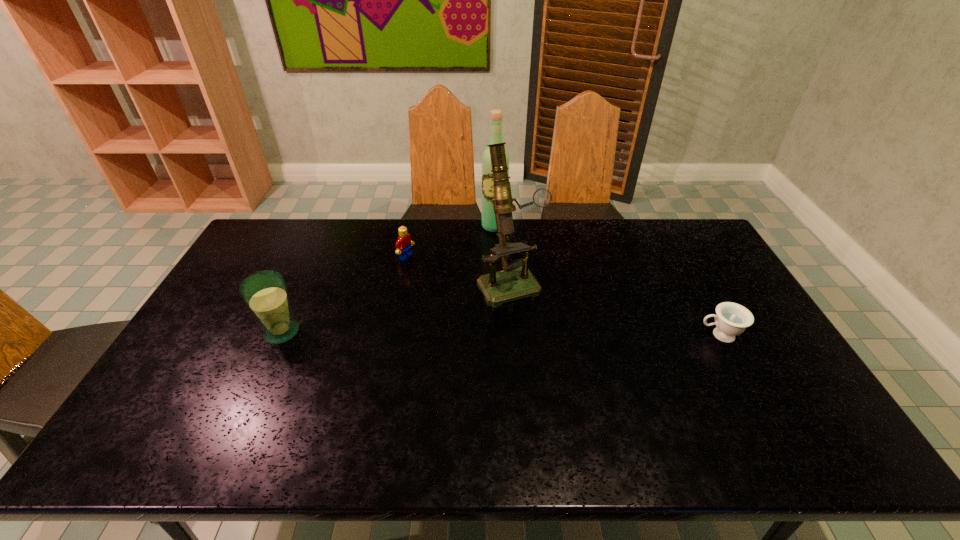
Image resolution: width=960 pixels, height=540 pixels. What are the coordinates of `vacant area situated at the eyepiece of the microscope` in the screenshot? It's located at (572, 382).

Where is `Lego present at the far edge`? The width and height of the screenshot is (960, 540). Lego present at the far edge is located at coordinates (403, 245).

The image size is (960, 540). I want to click on wine bottle that is at the far edge, so click(x=488, y=216).

What are the coordinates of `object that is positioned at the right edge` in the screenshot? It's located at (731, 319).

In the image, there is a desktop. Identify the location of free space at the far edge. (351, 219).

In the image, there is a desktop. Where is `vacant space at the near edge`? The image size is (960, 540). vacant space at the near edge is located at coordinates (732, 403).

Identify the location of free space at the left edge. (204, 318).

In the image, there is a desktop. Where is `vacant space at the right edge`? The width and height of the screenshot is (960, 540). vacant space at the right edge is located at coordinates (731, 292).

You are a GUI agent. You are given a task and a screenshot of the screen. Output one action in this format:
    pyautogui.click(x=<x>, y=<y>)
    Task: Click on the vacant space at the far right corner of the desktop
    The image size is (960, 540).
    Given the screenshot: What is the action you would take?
    pyautogui.click(x=671, y=252)

At what (x,y) coordinates should I click in order to perform the action: click on vacant area that lies between the microscope and the third shortest object. Please return your answer as a coordinate pair (x, y). This screenshot has height=540, width=960. Looking at the image, I should click on (396, 307).